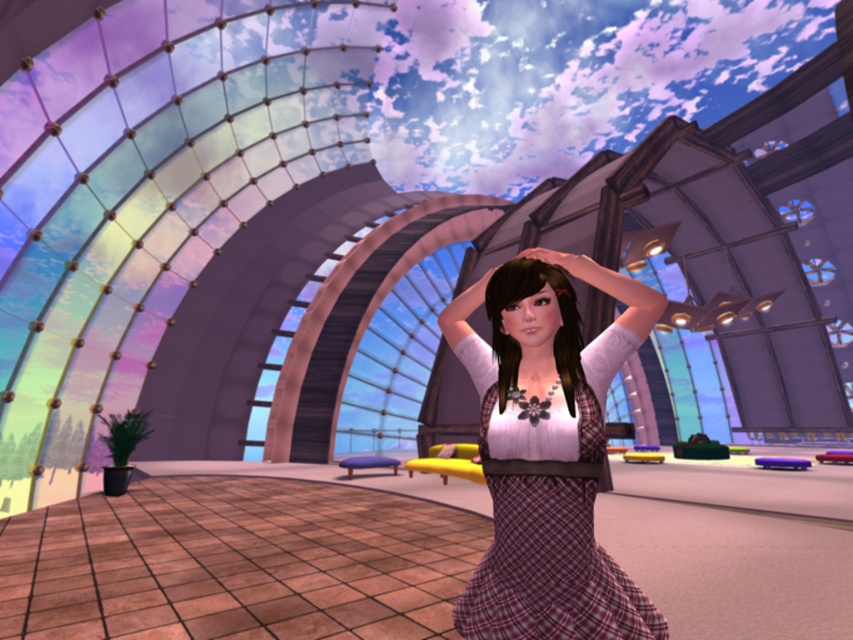
Question: Which of the following is the farthest from the observer?

Choices:
 (A) (543, 280)
 (B) (643, 612)

Answer: (B)

Question: Is plaid fabric dress at center thinner than pink matte hand at center?

Choices:
 (A) no
 (B) yes

Answer: (A)

Question: Can you confirm if plaid fabric dress at center is positioned above matte black hair at center?

Choices:
 (A) yes
 (B) no

Answer: (B)

Question: Which point is closer to the camera?

Choices:
 (A) coord(583,257)
 (B) coord(573,298)
 (C) coord(573,381)

Answer: (B)

Question: Which object appears farthest from the camera in this image?

Choices:
 (A) plaid fabric dress at center
 (B) pink matte hand at center

Answer: (B)

Question: From the image, what is the correct spatial relationship of plaid fabric dress at center in relation to matte black hair at center?

Choices:
 (A) right
 (B) left

Answer: (A)